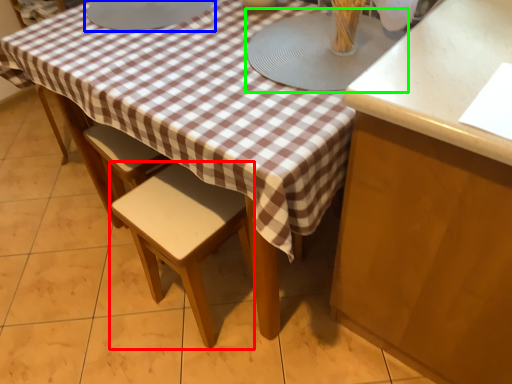
Question: Considering the real-world distances, which object is closest to stool (highlighted by a red box)? round table (highlighted by a blue box) or round table (highlighted by a green box).

Choices:
 (A) round table
 (B) round table

Answer: (B)